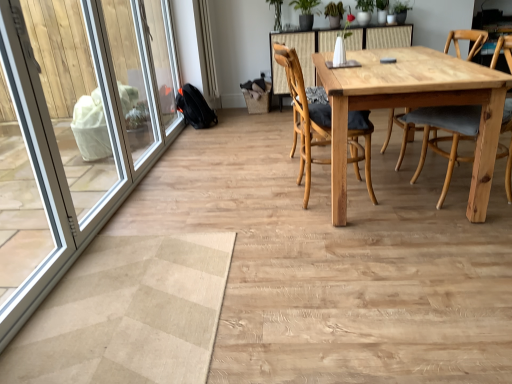
Locate an element on the screen. This screenshot has width=512, height=384. vacant region to the left of wooden chair at center, which is the first chair from left to right is located at coordinates (249, 196).